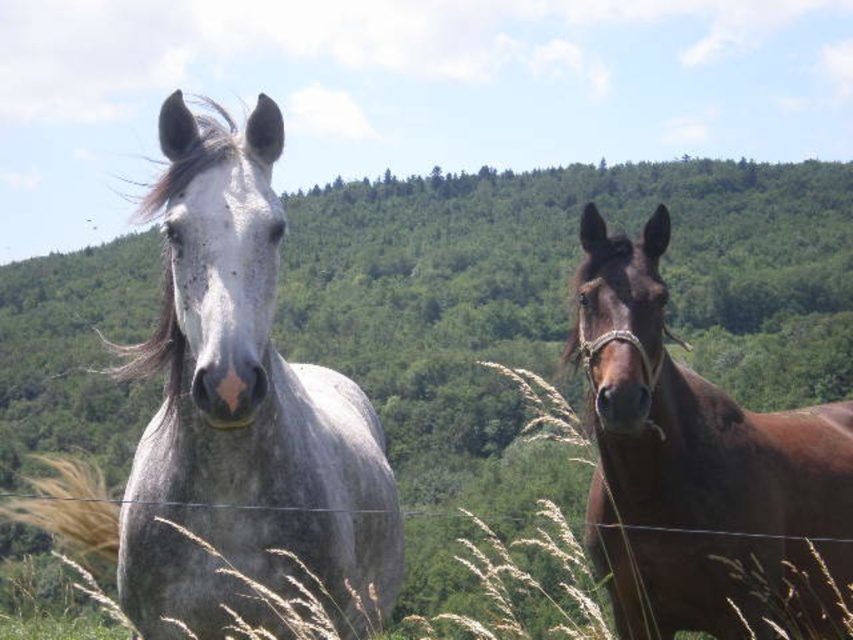
Is point (256, 317) positioned before point (643, 336)?

Yes, point (256, 317) is closer to viewer.

Can you confirm if gray speckled horse at center is smaller than brown glossy horse at right?

Yes, gray speckled horse at center is smaller than brown glossy horse at right.

Image resolution: width=853 pixels, height=640 pixels. I want to click on gray speckled horse at center, so click(242, 410).

I want to click on gray speckled horse at center, so click(242, 410).